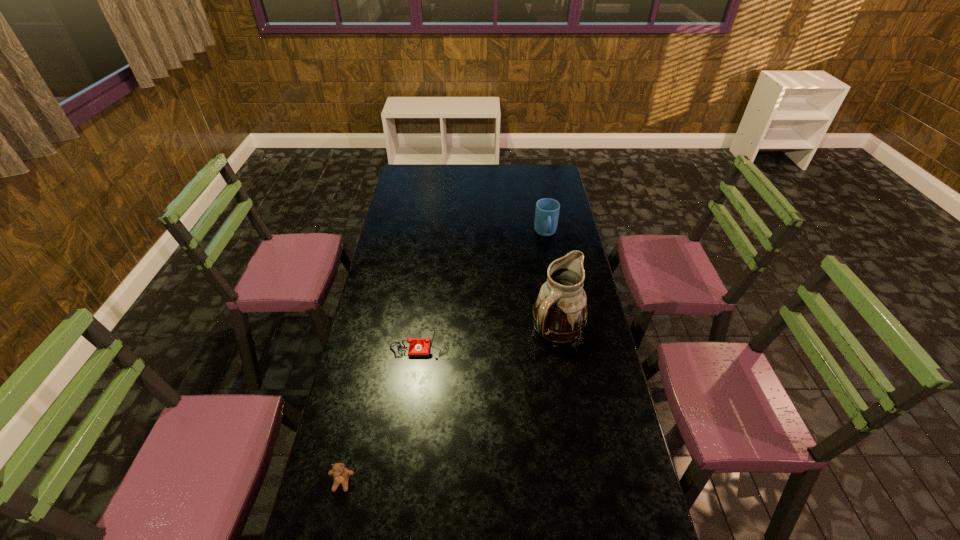
Find the location of a particular element. This screenshot has height=540, width=960. vacant space located 0.400m on the dial of the third object from right to left is located at coordinates (404, 472).

Identify the location of teddy bear that is at the left edge. coord(341,475).

Locate an element on the screen. telephone that is positioned at the left edge is located at coordinates (418, 347).

At what (x,y) coordinates should I click in order to perform the action: click on pitcher situated at the right edge. Please return your answer as a coordinate pair (x, y). Looking at the image, I should click on (560, 312).

Where is `mug situated at the right edge`? Image resolution: width=960 pixels, height=540 pixels. mug situated at the right edge is located at coordinates (547, 210).

Find the location of a particular element. vacant space at the far edge is located at coordinates (506, 169).

Locate an element on the screen. free space at the left edge of the desktop is located at coordinates (383, 374).

The width and height of the screenshot is (960, 540). In the image, there is a desktop. Find the location of `vacant space at the right edge`. vacant space at the right edge is located at coordinates (556, 198).

Where is `empty space that is in between the leftmost object and the tallest object`? The image size is (960, 540). empty space that is in between the leftmost object and the tallest object is located at coordinates (450, 406).

Locate an element on the screen. This screenshot has height=540, width=960. free area in between the shortest object and the teddy bear is located at coordinates (381, 413).